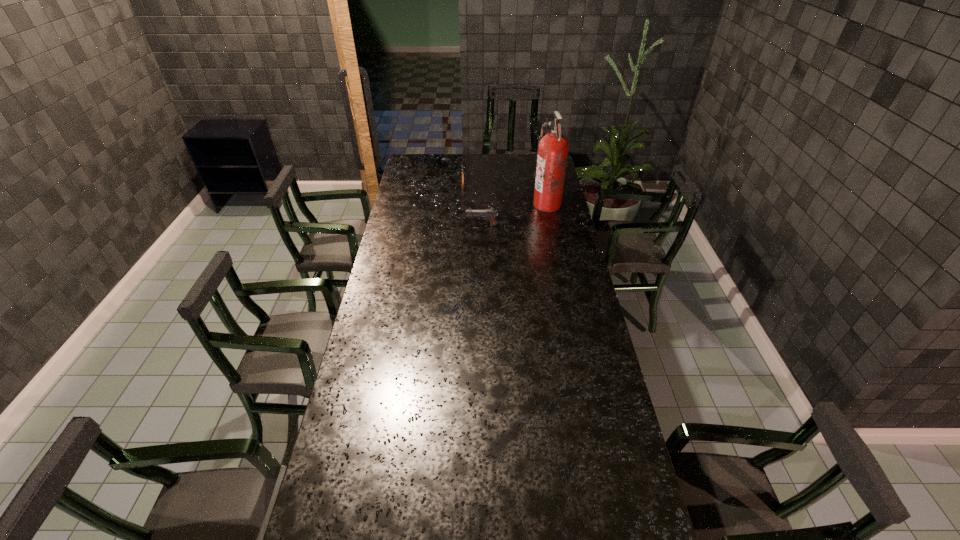
Locate an element on the screen. The image size is (960, 540). free space at the far right corner of the desktop is located at coordinates (528, 164).

Identify the location of free space between the leftmost object and the nearest object. (472, 203).

Find the location of a particular element. vacant space in between the second farthest object and the right gun is located at coordinates (515, 215).

In order to click on free spot between the farthest object and the fire extinguisher in this screenshot , I will do `click(505, 193)`.

This screenshot has width=960, height=540. What are the coordinates of `vacant area that lies between the leftmost object and the right gun` in the screenshot? It's located at (472, 203).

Choose which object is the second nearest neighbor to the second nearest object. Please provide its 2D coordinates. Your answer should be formatted as a tuple, i.e. [(x, y)], where the tuple contains the x and y coordinates of a point satisfying the conditions above.

[(462, 165)]

I want to click on object that stands as the second closest to the nearest object, so click(x=462, y=165).